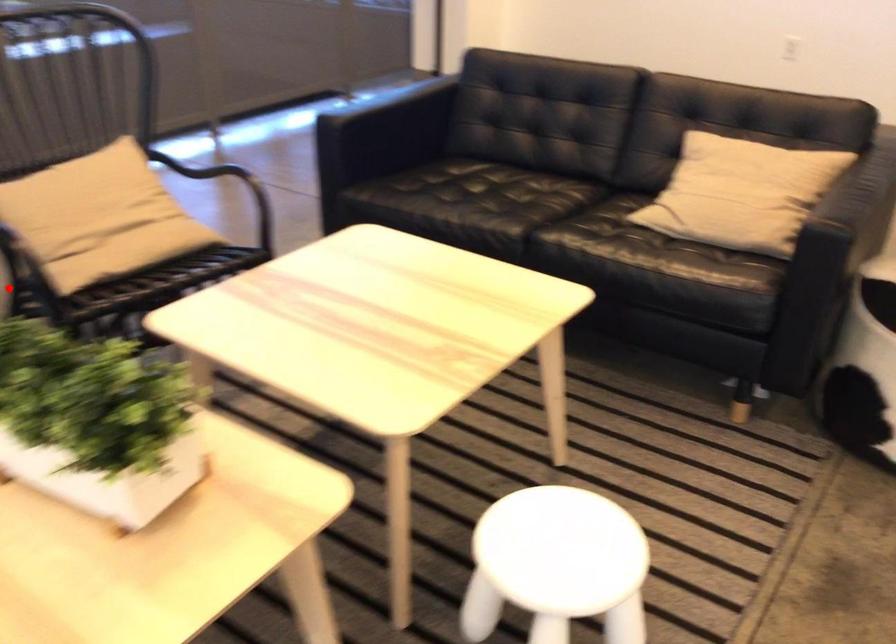
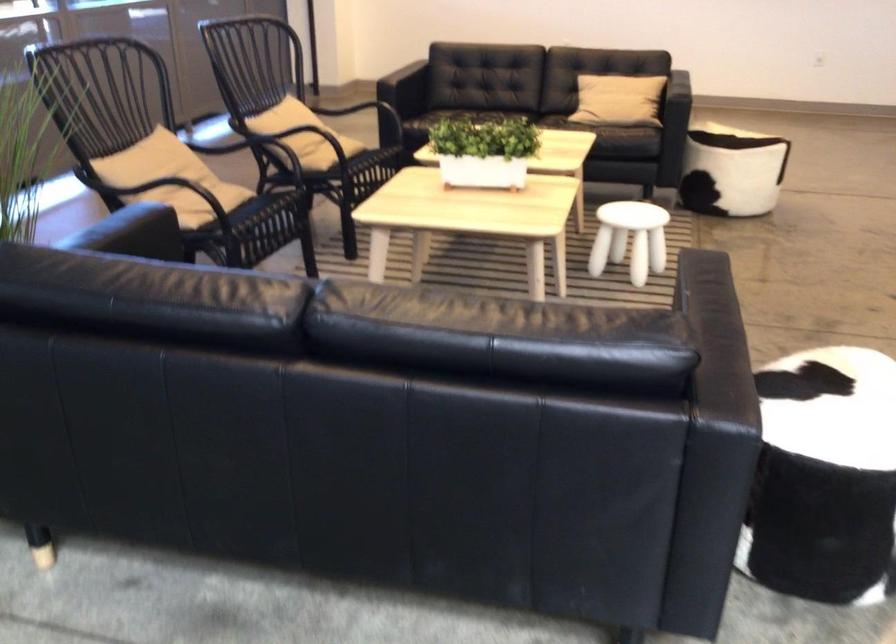
Question: I am providing you with two images of the same scene from different viewpoints. A red point is marked on the first image. Can you still see the location of the red point in image 2?

Choices:
 (A) Yes
 (B) No

Answer: (B)